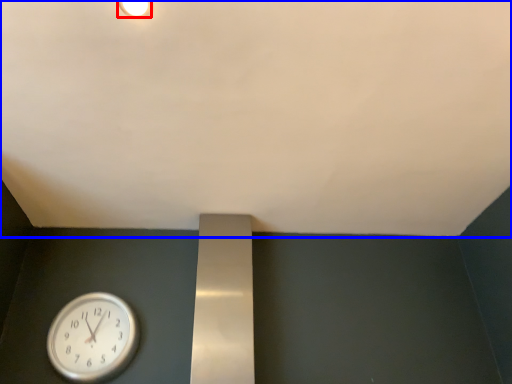
Question: Which object appears farthest to the camera in this image, light fixture (highlighted by a red box) or backdrop (highlighted by a blue box)?

Choices:
 (A) light fixture
 (B) backdrop

Answer: (A)